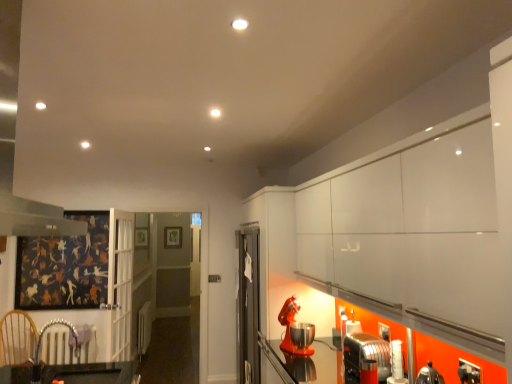
Question: Does metallic silver toaster at lower right, the 2th appliance from the back, turn towards wooden armchair at lower left?

Choices:
 (A) no
 (B) yes

Answer: (B)

Question: Is metallic silver toaster at lower right, marked as the 1th appliance in a right-to-left arrangement, taller than wooden armchair at lower left?

Choices:
 (A) no
 (B) yes

Answer: (A)

Question: Considering the relative sizes of metallic silver toaster at lower right, the 2th appliance from the back, and wooden armchair at lower left in the image provided, is metallic silver toaster at lower right, the 2th appliance from the back, bigger than wooden armchair at lower left?

Choices:
 (A) no
 (B) yes

Answer: (B)

Question: From a real-world perspective, is metallic silver toaster at lower right, the 2th appliance from the back, over wooden armchair at lower left?

Choices:
 (A) yes
 (B) no

Answer: (B)

Question: Can wooden armchair at lower left be found inside metallic silver toaster at lower right, marked as the 1th appliance in a right-to-left arrangement?

Choices:
 (A) yes
 (B) no

Answer: (B)

Question: Is metallic silver toaster at lower right, which is the 2th appliance from left to right, at the right side of wooden armchair at lower left?

Choices:
 (A) no
 (B) yes

Answer: (B)

Question: Is wooden armchair at lower left to the right of metallic silver toaster at lower right, the 2th appliance from the back, from the viewer's perspective?

Choices:
 (A) yes
 (B) no

Answer: (B)

Question: Is wooden armchair at lower left oriented away from metallic silver toaster at lower right, the first appliance when ordered from front to back?

Choices:
 (A) yes
 (B) no

Answer: (B)

Question: Can metallic silver toaster at lower right, the first appliance when ordered from front to back, be found inside wooden armchair at lower left?

Choices:
 (A) no
 (B) yes

Answer: (A)

Question: From the image's perspective, is wooden armchair at lower left on metallic silver toaster at lower right, marked as the 1th appliance in a right-to-left arrangement?

Choices:
 (A) no
 (B) yes

Answer: (B)

Question: Are wooden armchair at lower left and metallic silver toaster at lower right, marked as the 1th appliance in a right-to-left arrangement, located far from each other?

Choices:
 (A) no
 (B) yes

Answer: (B)

Question: Is wooden armchair at lower left bigger than metallic silver toaster at lower right, marked as the 1th appliance in a right-to-left arrangement?

Choices:
 (A) no
 (B) yes

Answer: (A)

Question: Is orange matte stand mixer at lower right, arranged as the 1th appliance when viewed from the left, to the left of metallic silver toaster at lower right, which is the 2th appliance from left to right, from the viewer's perspective?

Choices:
 (A) no
 (B) yes

Answer: (B)